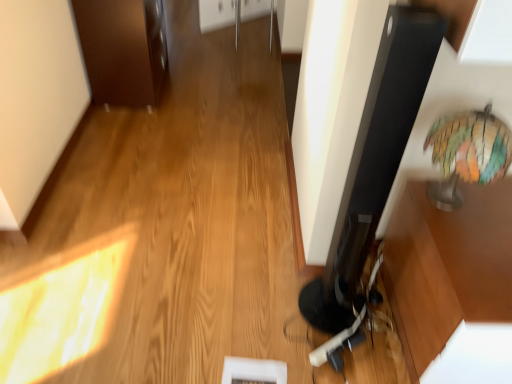
Question: Is multicolored glass globe at right positioned before brown wood cabinet at upper left?

Choices:
 (A) no
 (B) yes

Answer: (B)

Question: Does multicolored glass globe at right have a lesser width compared to brown wood cabinet at upper left?

Choices:
 (A) yes
 (B) no

Answer: (A)

Question: From a real-world perspective, is multicolored glass globe at right positioned over brown wood cabinet at upper left based on gravity?

Choices:
 (A) yes
 (B) no

Answer: (A)

Question: Does multicolored glass globe at right have a greater width compared to brown wood cabinet at upper left?

Choices:
 (A) no
 (B) yes

Answer: (A)

Question: From a real-world perspective, does multicolored glass globe at right sit lower than brown wood cabinet at upper left?

Choices:
 (A) no
 (B) yes

Answer: (A)

Question: Does multicolored glass globe at right have a smaller size compared to brown wood cabinet at upper left?

Choices:
 (A) no
 (B) yes

Answer: (B)

Question: Is brown wood cabinet at upper left positioned behind multicolored glass globe at right?

Choices:
 (A) no
 (B) yes

Answer: (B)

Question: Can you confirm if brown wood cabinet at upper left is wider than multicolored glass globe at right?

Choices:
 (A) yes
 (B) no

Answer: (A)

Question: Can you confirm if brown wood cabinet at upper left is positioned to the right of multicolored glass globe at right?

Choices:
 (A) yes
 (B) no

Answer: (B)

Question: Is brown wood cabinet at upper left smaller than multicolored glass globe at right?

Choices:
 (A) no
 (B) yes

Answer: (A)

Question: Is brown wood cabinet at upper left not near multicolored glass globe at right?

Choices:
 (A) no
 (B) yes

Answer: (B)

Question: Is brown wood cabinet at upper left surrounding multicolored glass globe at right?

Choices:
 (A) no
 (B) yes

Answer: (A)

Question: Is brown wood cabinet at upper left wider or thinner than multicolored glass globe at right?

Choices:
 (A) wide
 (B) thin

Answer: (A)